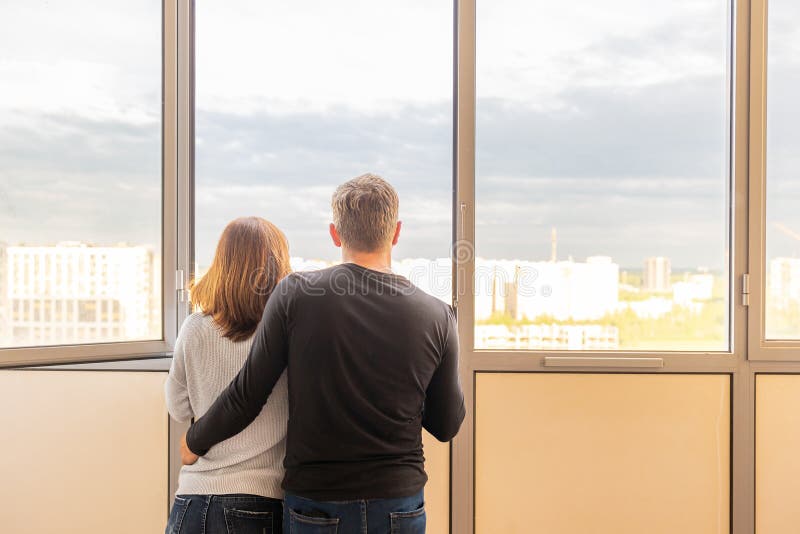
Find the location of a particular element. The width and height of the screenshot is (800, 534). window is located at coordinates (470, 81), (186, 121).